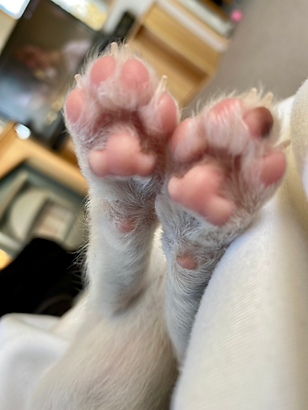
Find the location of `window`. window is located at coordinates (14, 5).